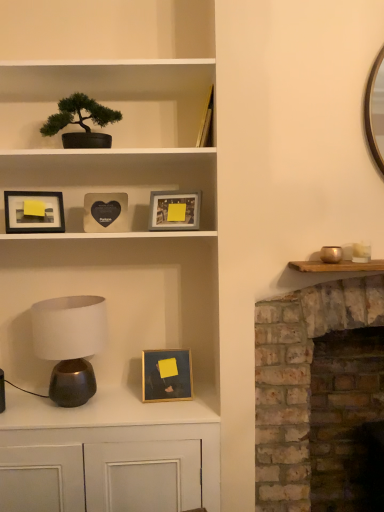
The width and height of the screenshot is (384, 512). I want to click on unoccupied region to the right of satin white lampshade at lower left, so click(131, 407).